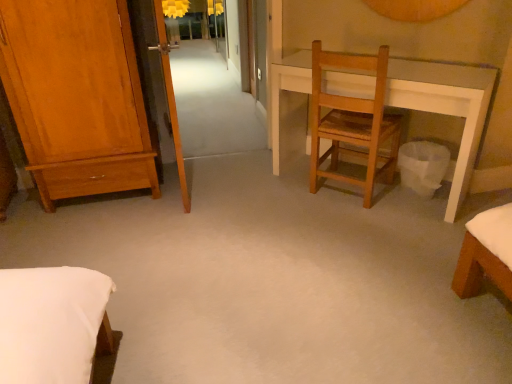
Locate an element on the screen. vacant space underneath white paper trash can at lower right (from a real-world perspective) is located at coordinates (412, 199).